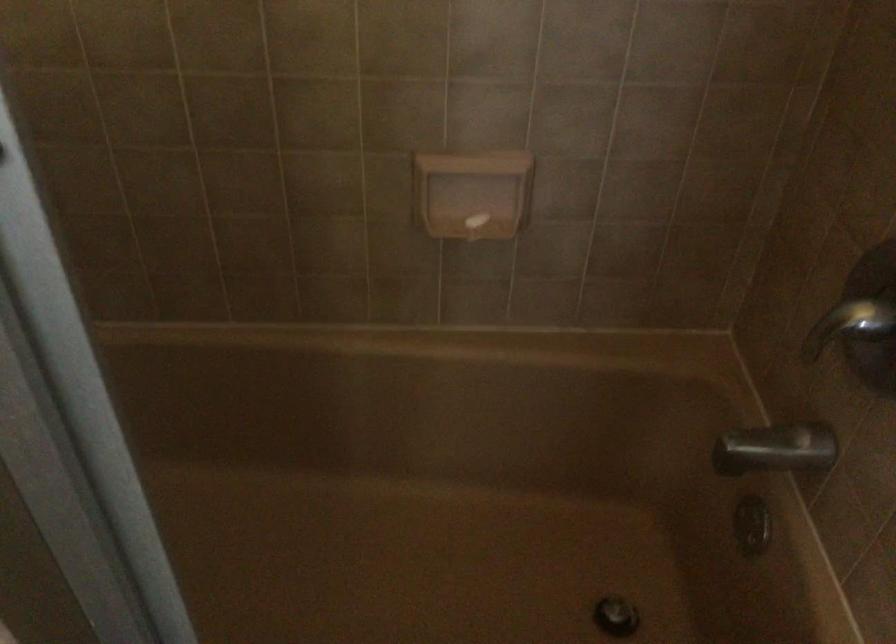
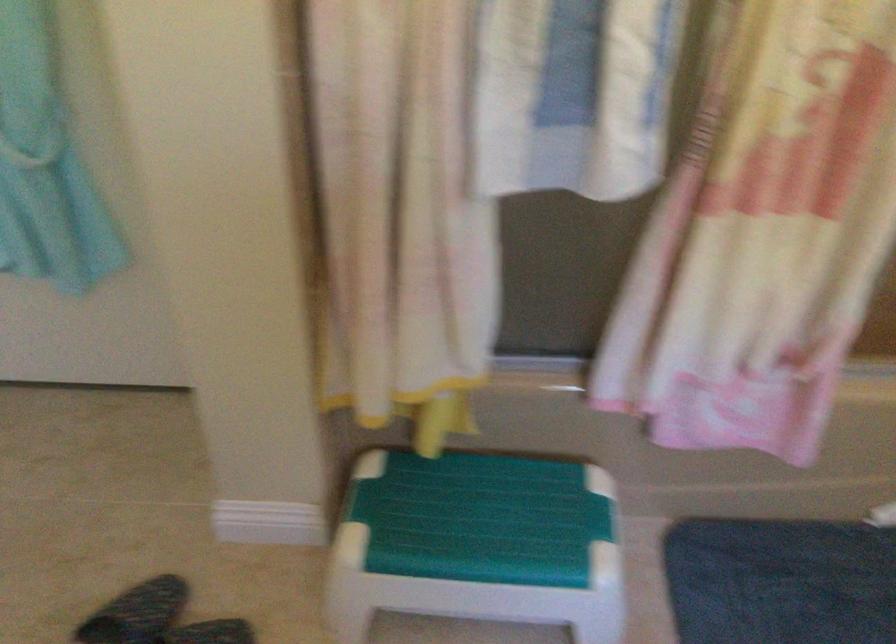
Question: The first image is from the beginning of the video and the second image is from the end. How did the camera likely rotate when shooting the video?

Choices:
 (A) Left
 (B) Right
 (C) Up
 (D) Down

Answer: (A)